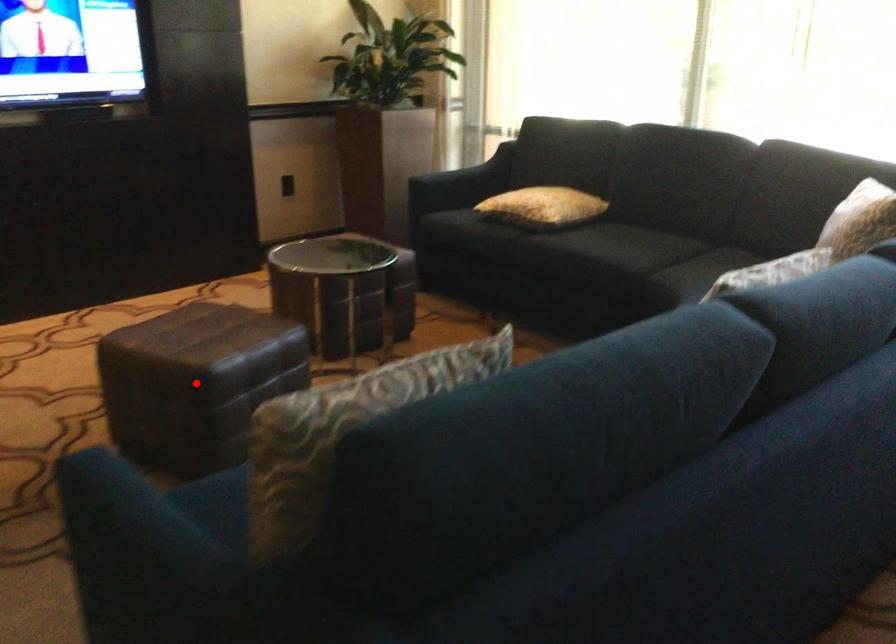
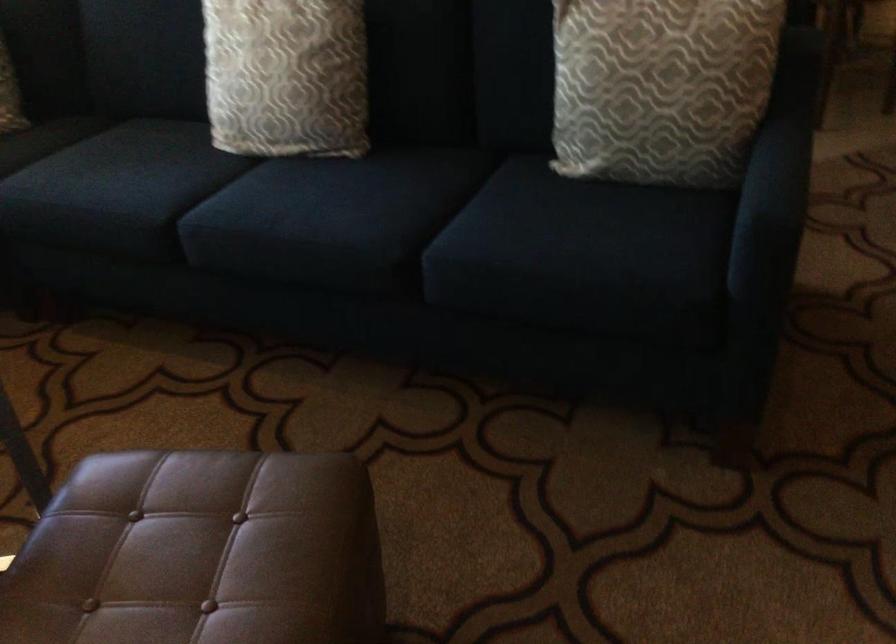
Find the pixel in the second image that matches the highlighted location in the first image.

(373, 476)